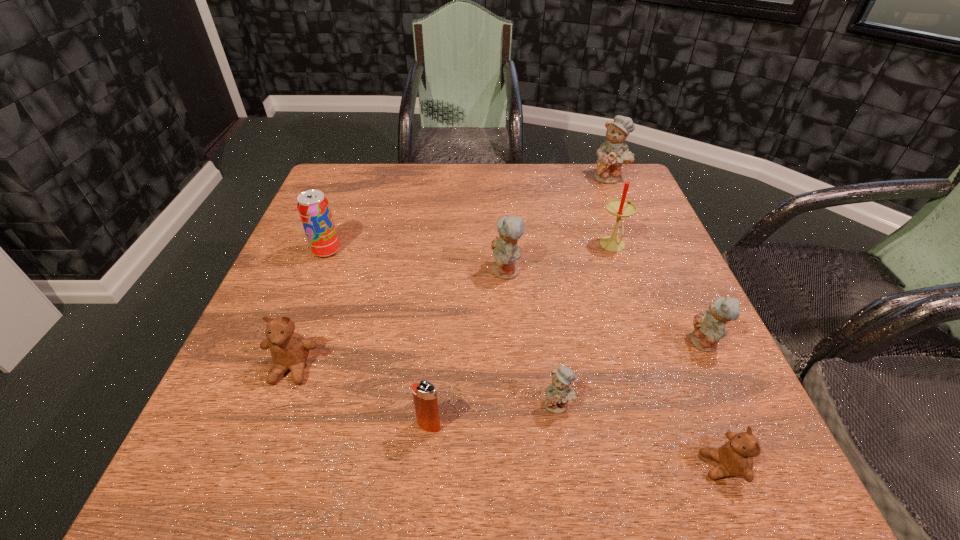
In order to click on the farthest blue teddy bear in this screenshot , I will do `click(611, 155)`.

Find the location of a particular element. Image resolution: width=960 pixels, height=540 pixels. the tallest teddy bear is located at coordinates (611, 155).

This screenshot has width=960, height=540. What are the coordinates of `candle` in the screenshot? It's located at (620, 208).

This screenshot has height=540, width=960. I want to click on the second teddy bear from left to right, so click(506, 251).

Image resolution: width=960 pixels, height=540 pixels. I want to click on the fifth shortest teddy bear, so click(506, 251).

At what (x,y) coordinates should I click in order to perform the action: click on soda can. Please return your answer as a coordinate pair (x, y). This screenshot has height=540, width=960. Looking at the image, I should click on (313, 207).

This screenshot has width=960, height=540. Identify the location of the third biggest blue teddy bear. point(709,326).

Identify the location of the leftmost teddy bear. Image resolution: width=960 pixels, height=540 pixels. (289, 350).

Locate an element on the screen. This screenshot has width=960, height=540. the bigger brown teddy bear is located at coordinates [x=289, y=350].

Identify the location of igniter. (424, 393).